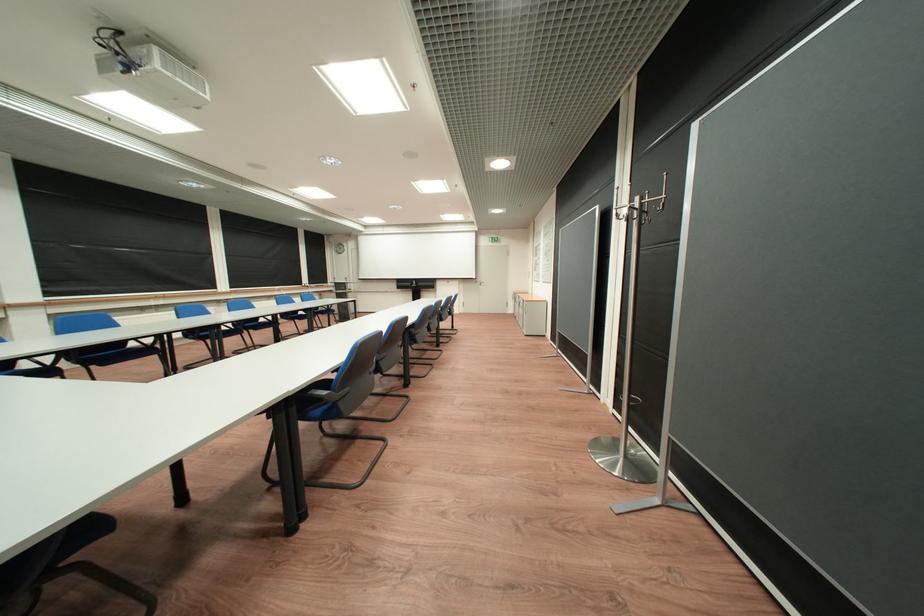
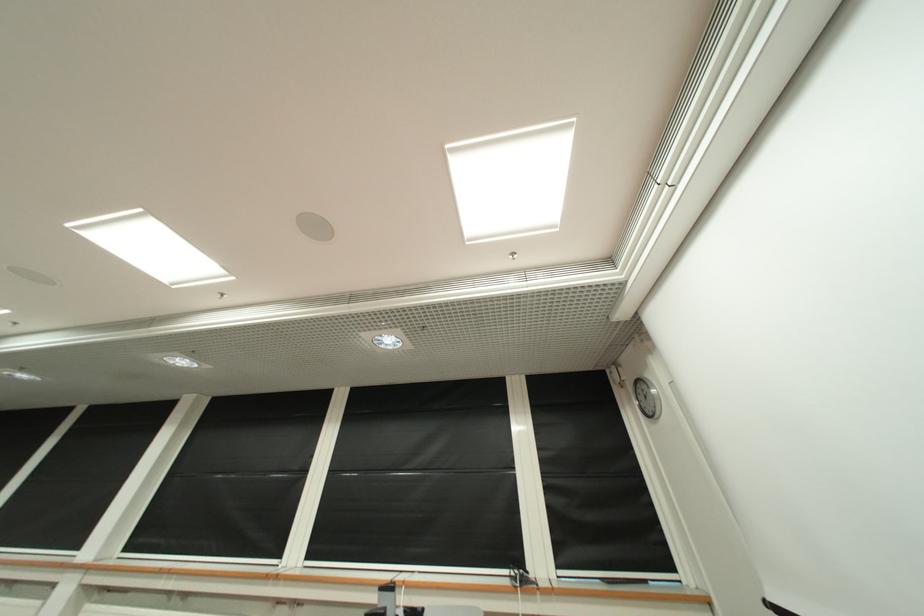
Locate, in the second image, the point that corresponds to [344,249] in the first image.

(642, 402)